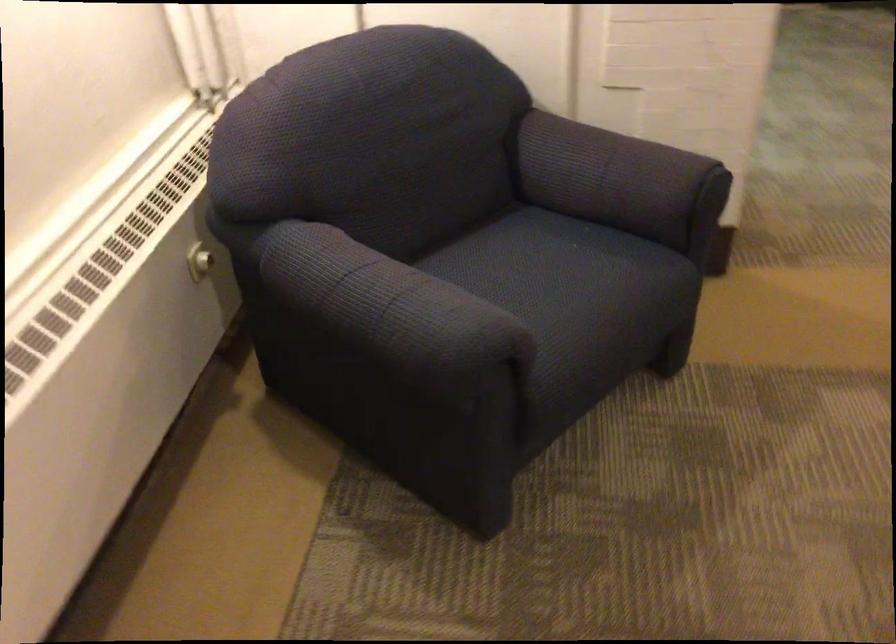
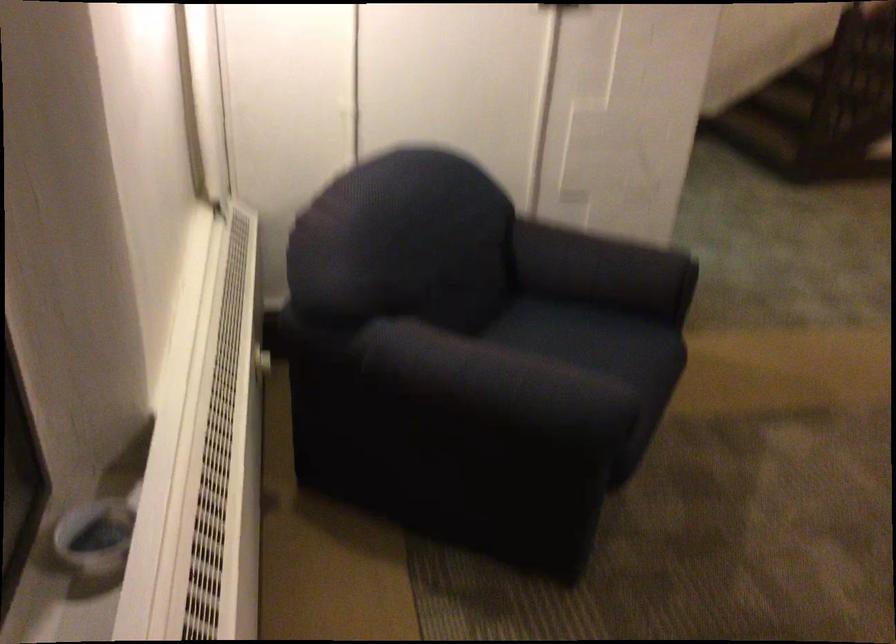
Locate, in the second image, the point that corresponds to (x=600, y=185) in the first image.

(604, 270)